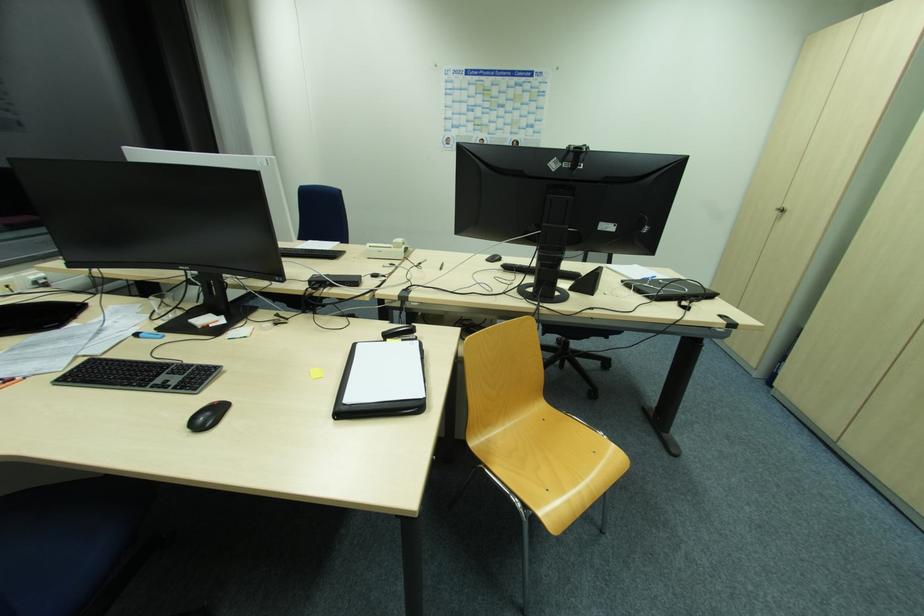
Image resolution: width=924 pixels, height=616 pixels. Identify the location of black computer mouse. (208, 416).